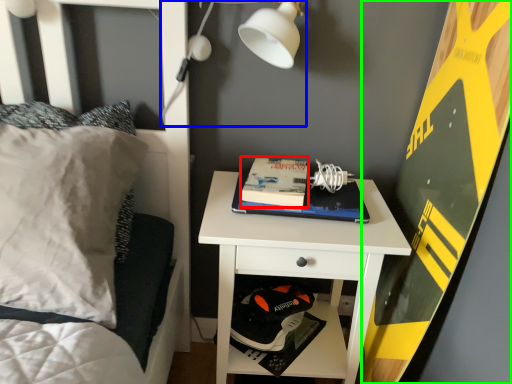
Question: Estimate the real-world distances between objects in this image. Which object is farther from paperback book (highlighted by a red box), light fixture (highlighted by a blue box) or bulletin board (highlighted by a green box)?

Choices:
 (A) light fixture
 (B) bulletin board

Answer: (B)